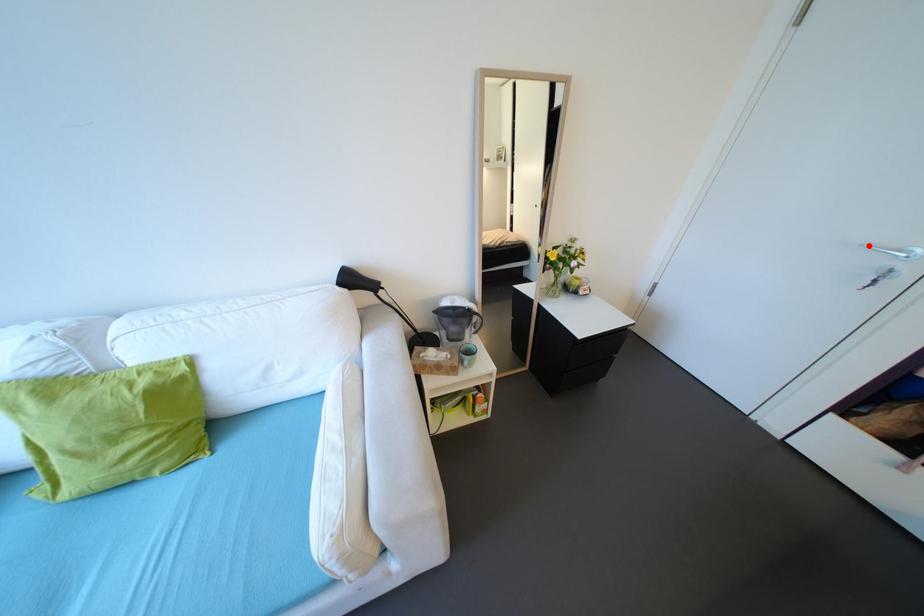
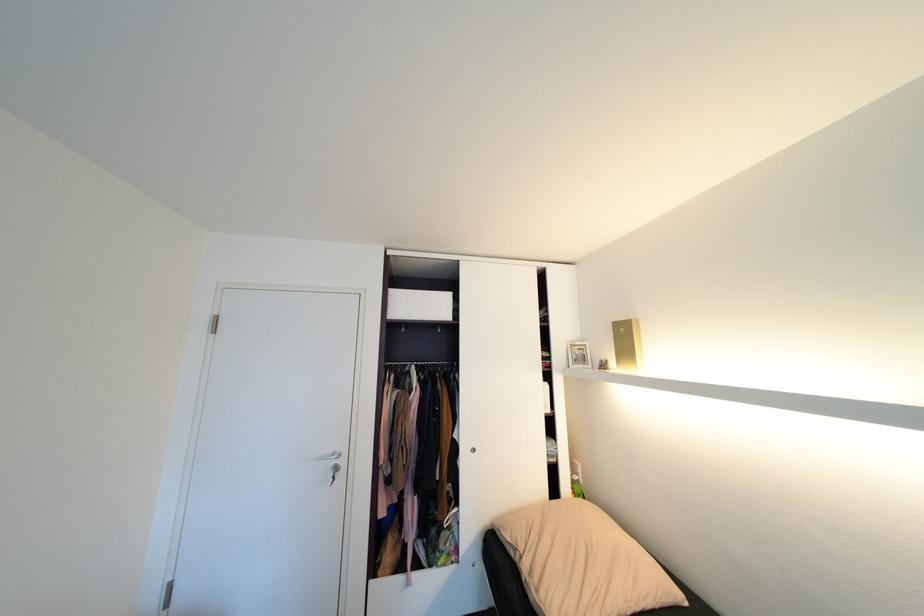
In the second image, find the point that corresponds to the highlighted location in the first image.

(322, 459)